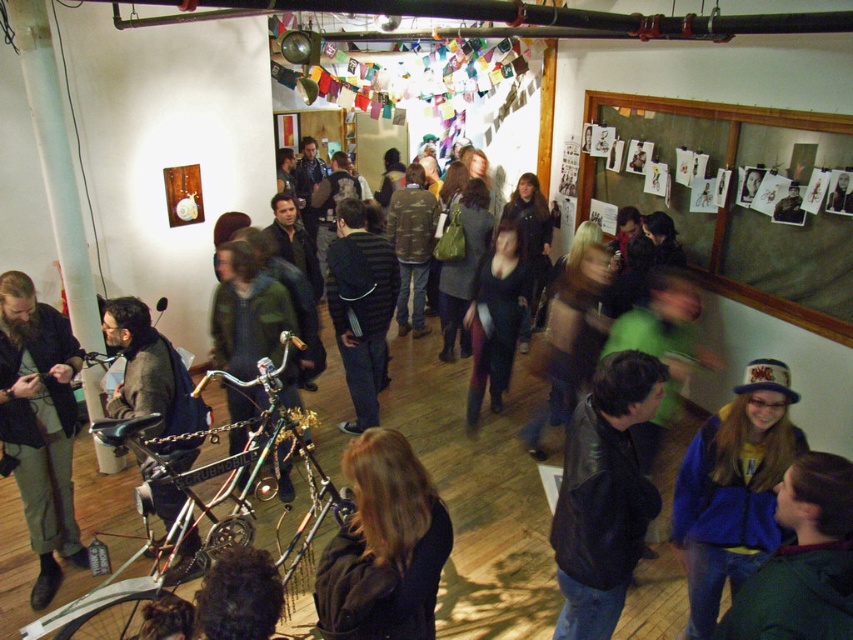
Can you confirm if striped sweater at center is smaller than white paper photos at upper right?

Yes.

Can you confirm if striped sweater at center is thinner than white paper photos at upper right?

Yes.

Find the location of `striped sweater at center`. striped sweater at center is located at coordinates (360, 307).

Who is taller, blue fuzzy jacket at lower right or dark blue jacket at lower right?

blue fuzzy jacket at lower right is taller.

Is blue fuzzy jacket at lower right below dark blue jacket at lower right?

Correct, blue fuzzy jacket at lower right is located below dark blue jacket at lower right.

Between point (715, 435) and point (808, 634), which one is positioned in front?

Point (808, 634) is in front.

Identify the location of blue fuzzy jacket at lower right. The width and height of the screenshot is (853, 640). (733, 490).

Who is more forward, (706, 100) or (503, 392)?

Point (706, 100) is in front.

Between white paper photos at upper right and matte black jacket at center, which one has less height?

Standing shorter between the two is white paper photos at upper right.

In order to click on white paper photos at upper right in this screenshot , I will do `click(720, 113)`.

At what (x,y) coordinates should I click in order to perform the action: click on white paper photos at upper right. Please return your answer as a coordinate pair (x, y). This screenshot has height=640, width=853. Looking at the image, I should click on (720, 113).